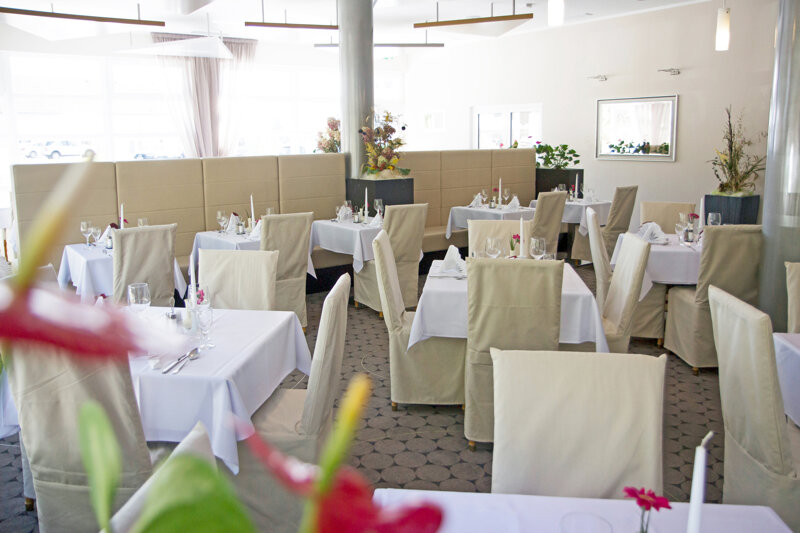
At what (x,y) coordinates should I click in order to perform the action: click on white candles. Please return your answer as a coordinate pair (x, y). The image size is (800, 533). Looking at the image, I should click on (521, 234), (498, 190), (576, 183), (365, 198), (252, 208), (121, 215), (192, 274), (698, 476), (698, 214).